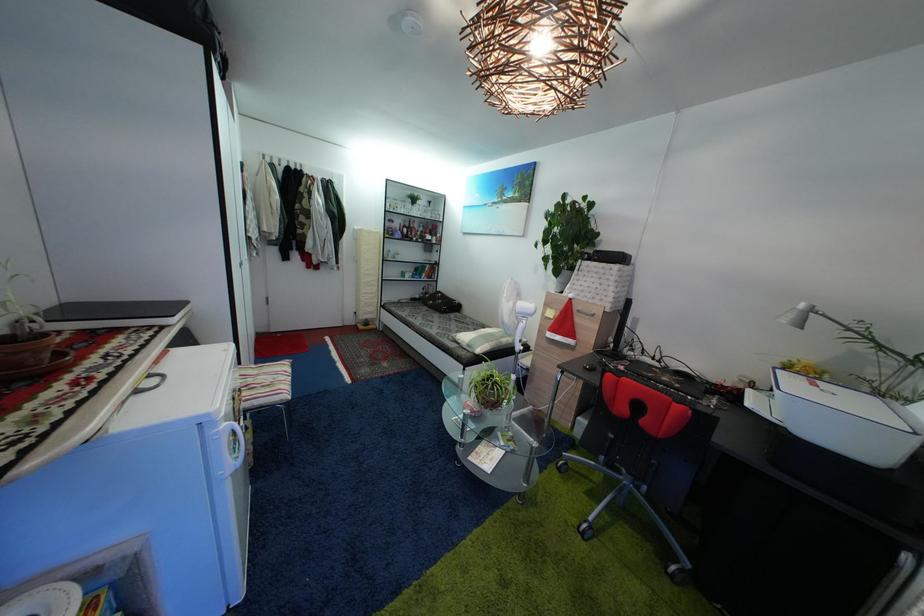
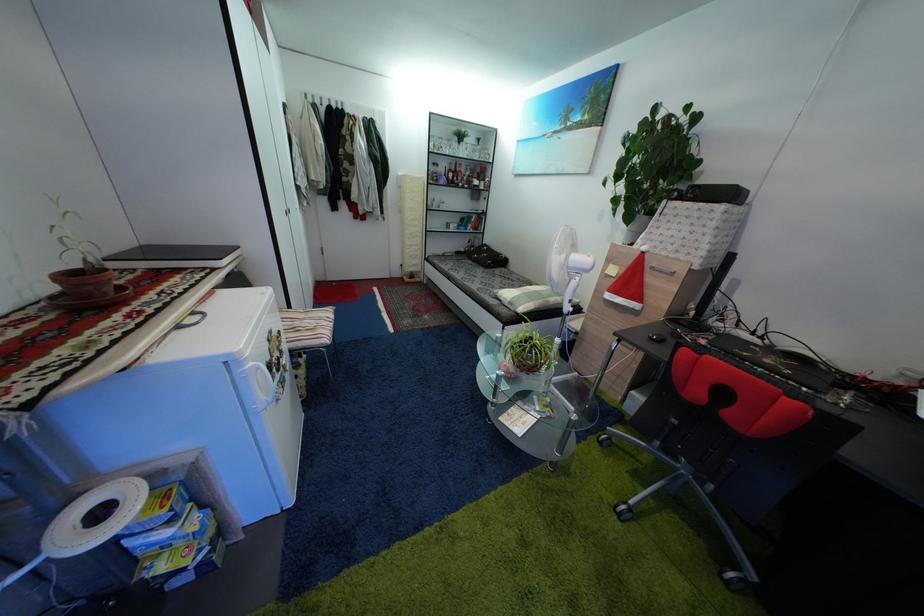
Question: The first image is from the beginning of the video and the second image is from the end. How did the camera likely rotate when shooting the video?

Choices:
 (A) Left
 (B) Right
 (C) Up
 (D) Down

Answer: (A)